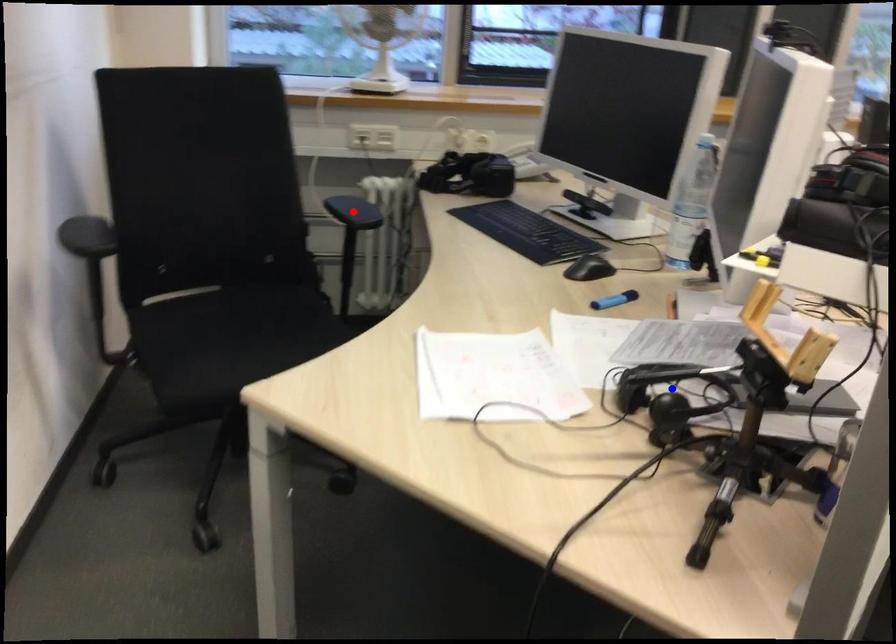
Question: Which of the two points in the image is closer to the camera?

Choices:
 (A) Blue point is closer.
 (B) Red point is closer.

Answer: (A)